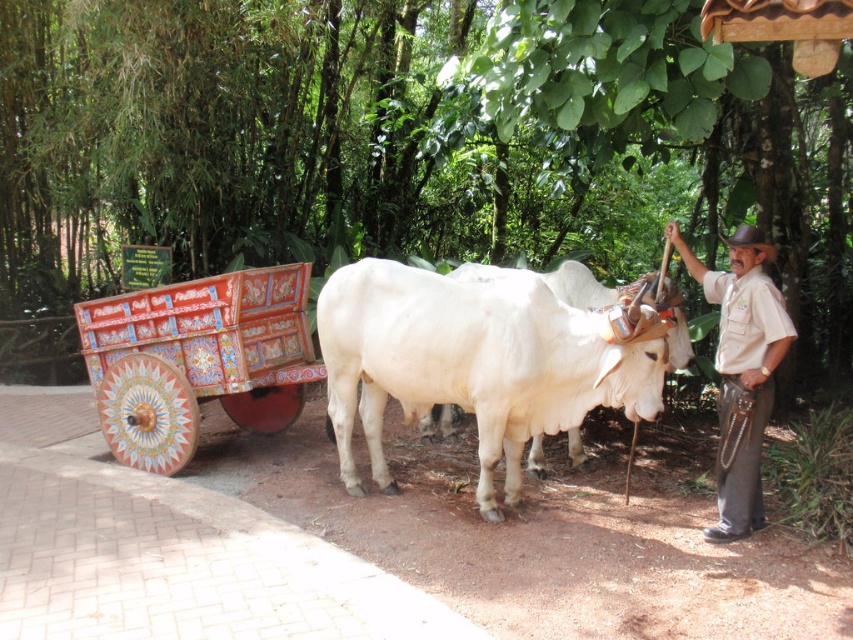
Does white smooth bull at center have a lesser width compared to beige uniform at center?

In fact, white smooth bull at center might be wider than beige uniform at center.

Which is above, white smooth bull at center or beige uniform at center?

beige uniform at center is higher up.

You are a GUI agent. You are given a task and a screenshot of the screen. Output one action in this format:
    pyautogui.click(x=<x>, y=<y>)
    Task: Click on the white smooth bull at center
    Image resolution: width=853 pixels, height=640 pixels.
    Given the screenshot: What is the action you would take?
    pyautogui.click(x=471, y=362)

Who is more distant from viewer, (844, 106) or (158, 360)?

The point (844, 106) is more distant.

Is green leafy tree at upper center thinner than painted wood wagon at left?

No, green leafy tree at upper center is not thinner than painted wood wagon at left.

Where is `green leafy tree at upper center`? Image resolution: width=853 pixels, height=640 pixels. green leafy tree at upper center is located at coordinates (393, 145).

Is white smooth bull at center positioned behind painted wood wagon at left?

No, white smooth bull at center is closer to the viewer.

Does white smooth bull at center have a smaller size compared to painted wood wagon at left?

Incorrect, white smooth bull at center is not smaller in size than painted wood wagon at left.

The height and width of the screenshot is (640, 853). I want to click on white smooth bull at center, so click(471, 362).